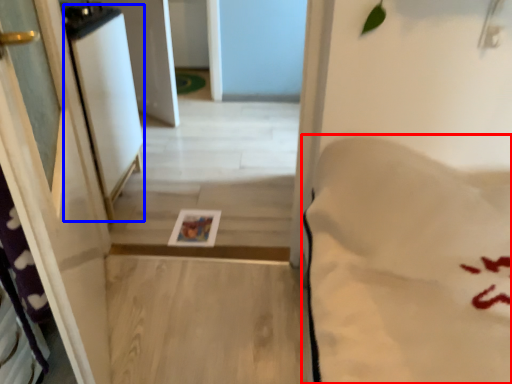
Question: Which object appears closest to the camera in this image, sheet (highlighted by a red box) or screen door (highlighted by a blue box)?

Choices:
 (A) sheet
 (B) screen door

Answer: (A)